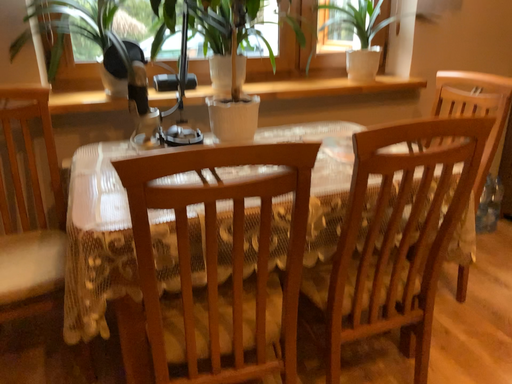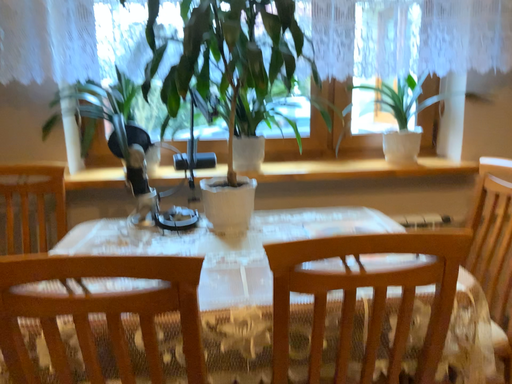
Question: How did the camera likely rotate when shooting the video?

Choices:
 (A) rotated left
 (B) rotated right

Answer: (A)